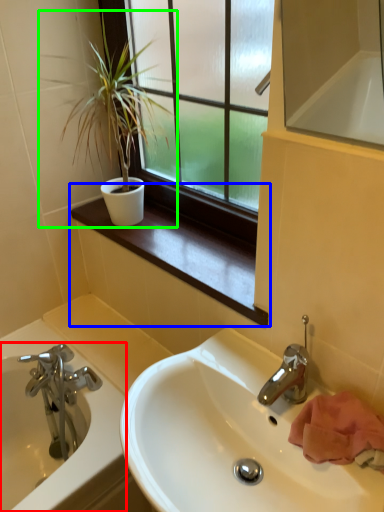
Question: Which is nearer to the bathtub (highlighted by a red box)? window sill (highlighted by a blue box) or houseplant (highlighted by a green box).

Choices:
 (A) window sill
 (B) houseplant

Answer: (A)